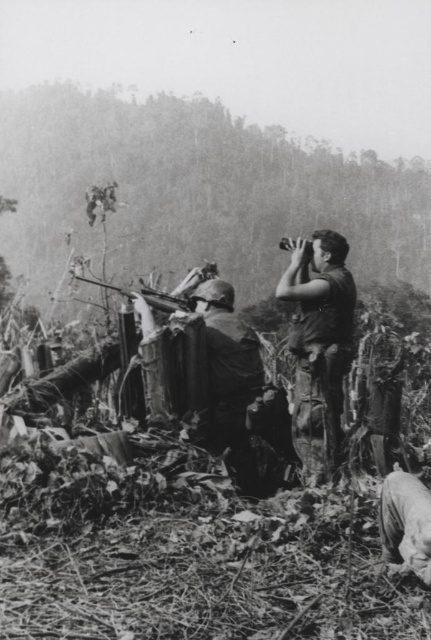
Is camouflage pants at right positioned in front of metallic rifle at center?

Yes, camouflage pants at right is in front of metallic rifle at center.

Does camouflage pants at right appear over metallic rifle at center?

No.

Image resolution: width=431 pixels, height=640 pixels. What do you see at coordinates (318, 342) in the screenshot? I see `camouflage pants at right` at bounding box center [318, 342].

In order to click on camouflage pants at right in this screenshot , I will do `click(318, 342)`.